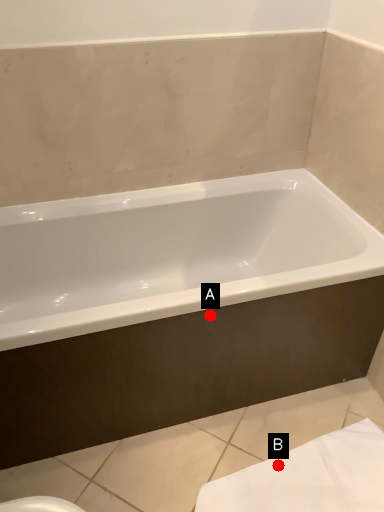
Question: Two points are circled on the image, labeled by A and B beside each circle. Which point is closer to the camera?

Choices:
 (A) A is closer
 (B) B is closer

Answer: (A)